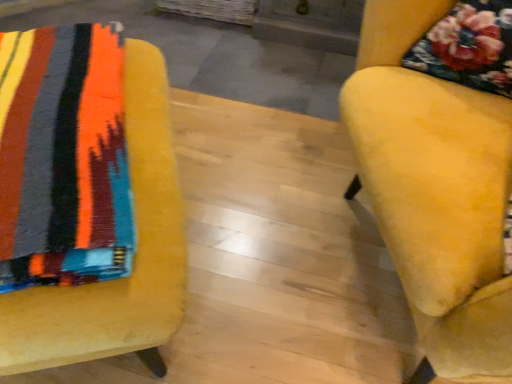
Where is `unoccupied region to the right of velvet yellow chair at left, which is the second chair in right-to-left order`? The width and height of the screenshot is (512, 384). unoccupied region to the right of velvet yellow chair at left, which is the second chair in right-to-left order is located at coordinates (250, 272).